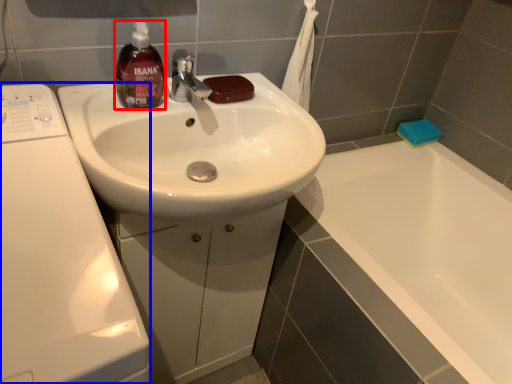
Question: Which object is further to the camera taking this photo, mouthwash (highlighted by a red box) or washing machine (highlighted by a blue box)?

Choices:
 (A) mouthwash
 (B) washing machine

Answer: (A)